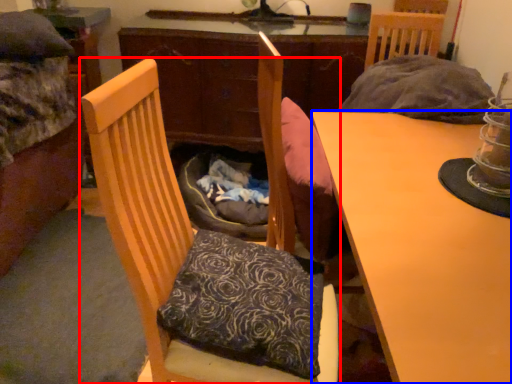
Question: Which object is closer to the camera taking this photo, chair (highlighted by a red box) or desk (highlighted by a blue box)?

Choices:
 (A) chair
 (B) desk

Answer: (B)